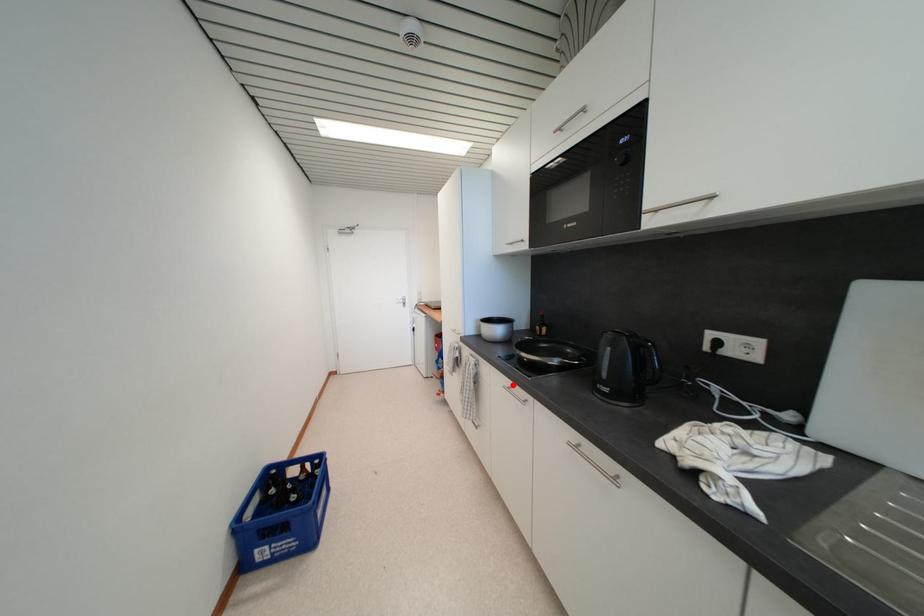
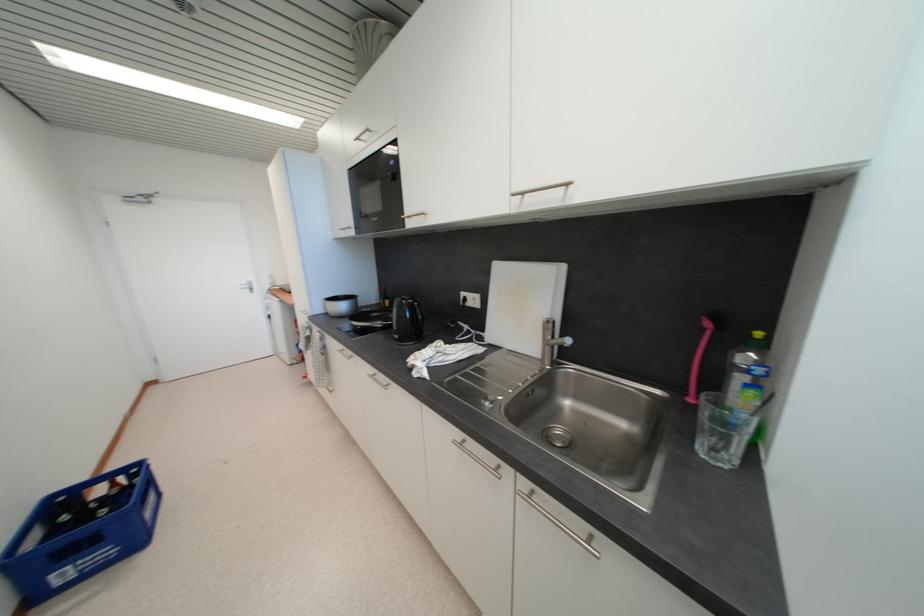
Where in the second image is the point corresponding to the highlighted location from the first image?

(346, 349)